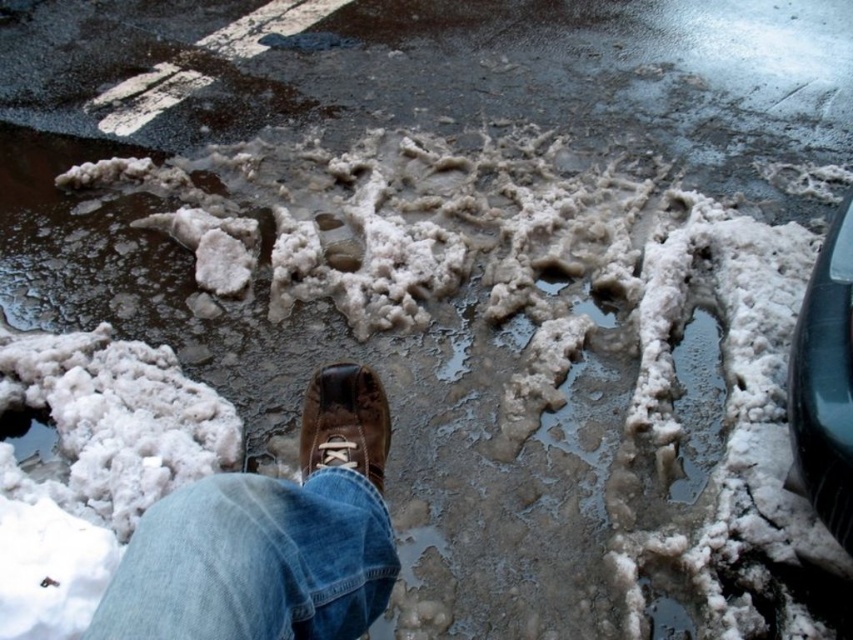
Question: Does brown leather boot at center appear on the left side of brown leather shoe at center?

Choices:
 (A) yes
 (B) no

Answer: (A)

Question: Which of the following is the closest to the observer?

Choices:
 (A) shiny black car at right
 (B) brown leather shoe at center
 (C) brown leather boot at center

Answer: (C)

Question: Which object is closer to the camera taking this photo?

Choices:
 (A) shiny black car at right
 (B) brown leather boot at center

Answer: (B)

Question: Is the position of shiny black car at right less distant than that of brown leather shoe at center?

Choices:
 (A) no
 (B) yes

Answer: (B)

Question: Which of the following is the farthest from the observer?

Choices:
 (A) (352, 595)
 (B) (316, 394)
 (C) (846, 464)

Answer: (B)

Question: Is shiny black car at right wider than brown leather shoe at center?

Choices:
 (A) no
 (B) yes

Answer: (B)